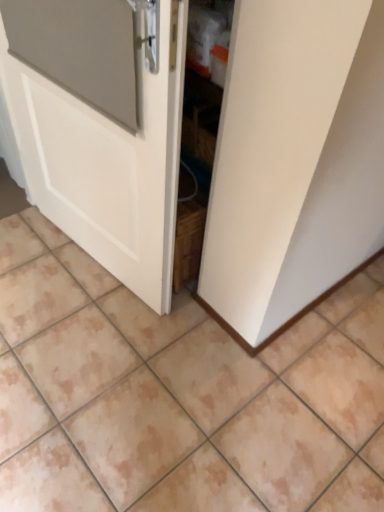
Question: Would you say white matte door at center contains beige ceramic tile at center?

Choices:
 (A) no
 (B) yes

Answer: (A)

Question: Could you tell me if white matte door at center is turned towards beige ceramic tile at center?

Choices:
 (A) yes
 (B) no

Answer: (B)

Question: Is white matte door at center outside beige ceramic tile at center?

Choices:
 (A) yes
 (B) no

Answer: (A)

Question: From the image's perspective, is white matte door at center located above beige ceramic tile at center?

Choices:
 (A) no
 (B) yes

Answer: (B)

Question: Is white matte door at center directly adjacent to beige ceramic tile at center?

Choices:
 (A) yes
 (B) no

Answer: (B)

Question: Is white matte door at center at the left side of beige ceramic tile at center?

Choices:
 (A) no
 (B) yes

Answer: (B)

Question: Is beige ceramic tile at center aimed at white matte door at center?

Choices:
 (A) no
 (B) yes

Answer: (A)

Question: From a real-world perspective, is beige ceramic tile at center over white matte door at center?

Choices:
 (A) no
 (B) yes

Answer: (A)

Question: From a real-world perspective, is beige ceramic tile at center under white matte door at center?

Choices:
 (A) no
 (B) yes

Answer: (B)

Question: Are beige ceramic tile at center and white matte door at center making contact?

Choices:
 (A) yes
 (B) no

Answer: (B)

Question: Is beige ceramic tile at center smaller than white matte door at center?

Choices:
 (A) no
 (B) yes

Answer: (A)

Question: Is white matte door at center inside beige ceramic tile at center?

Choices:
 (A) yes
 (B) no

Answer: (B)

Question: Based on their positions, is white matte door at center located to the left or right of beige ceramic tile at center?

Choices:
 (A) left
 (B) right

Answer: (A)